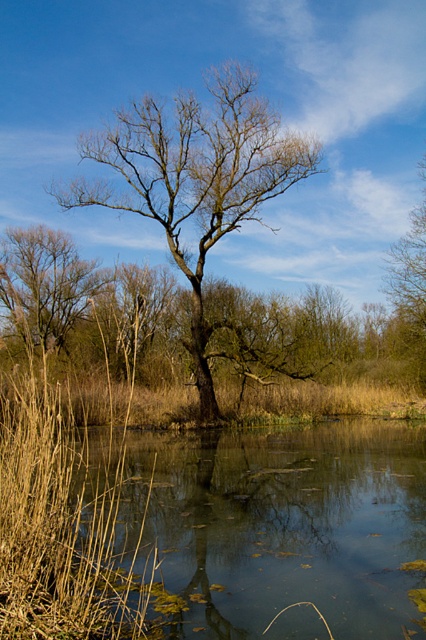
What do you see at coordinates (195, 179) in the screenshot?
I see `bare wood tree at center` at bounding box center [195, 179].

Does bare wood tree at center have a greater width compared to brown matte tree at upper right?

Indeed, bare wood tree at center has a greater width compared to brown matte tree at upper right.

Does point (167, 144) come farther from viewer compared to point (386, 285)?

That is False.

You are a GUI agent. You are given a task and a screenshot of the screen. Output one action in this format:
    pyautogui.click(x=<x>, y=<y>)
    Task: Click on the bare wood tree at center
    Image resolution: width=426 pixels, height=640 pixels.
    Given the screenshot: What is the action you would take?
    pyautogui.click(x=195, y=179)

Looking at this image, who is more forward, (189, 616) or (166, 225)?

Positioned in front is point (189, 616).

Is point (367, 634) in front of point (203, 221)?

Yes.

Locate an element on the screen. greenish reflective water at lower center is located at coordinates pos(273,525).

Which is above, brown grass at left or brown matte tree at upper right?

brown matte tree at upper right is above.

Which is in front, point (54, 532) or point (396, 355)?

Point (54, 532) is more forward.

At what (x,y) coordinates should I click in order to perform the action: click on brown grass at left. Please return your answer as a coordinate pair (x, y). Looking at the image, I should click on coord(57,468).